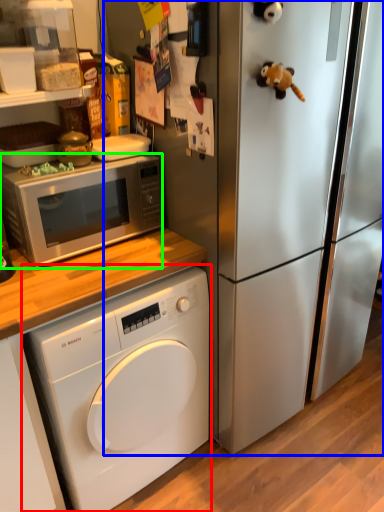
Question: Which object is the farthest from washing machine (highlighted by a red box)? Choose among these: refrigerator (highlighted by a blue box) or microwave oven (highlighted by a green box).

Choices:
 (A) refrigerator
 (B) microwave oven

Answer: (B)